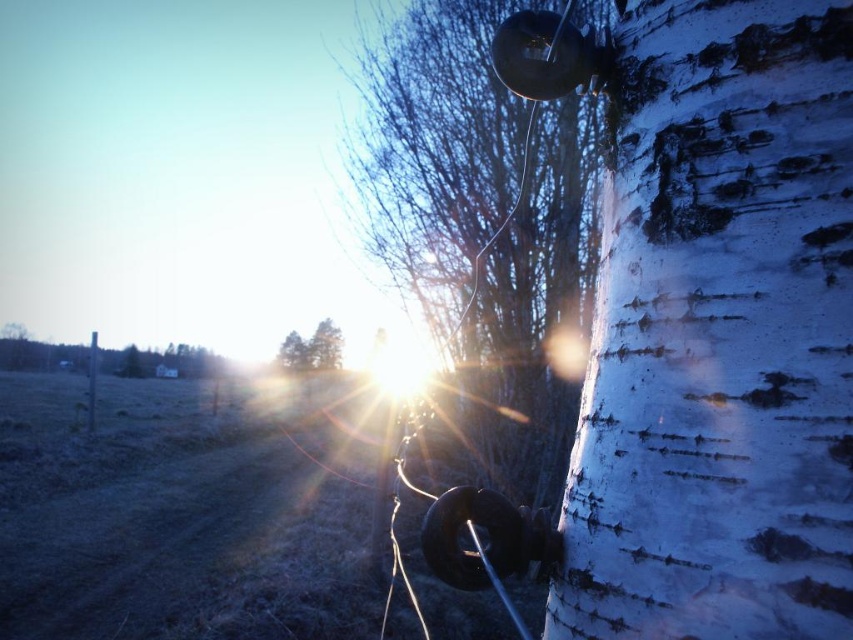
Between point (711, 502) and point (317, 348), which one is positioned in front?

Positioned in front is point (711, 502).

Who is lower down, white textured bark at right or brown wood trees at center?

brown wood trees at center

What do you see at coordinates (718, 333) in the screenshot?
I see `white textured bark at right` at bounding box center [718, 333].

Image resolution: width=853 pixels, height=640 pixels. I want to click on white textured bark at right, so click(718, 333).

Can you confirm if white textured bark at right is taller than smooth gray pole at center?

Incorrect, white textured bark at right's height is not larger of smooth gray pole at center's.

Who is higher up, white textured bark at right or smooth gray pole at center?

white textured bark at right is higher up.

Locate an element on the screen. This screenshot has height=640, width=853. white textured bark at right is located at coordinates (718, 333).

This screenshot has height=640, width=853. What are the coordinates of `white textured bark at right` in the screenshot? It's located at (718, 333).

Is white textured bark at upper right closer to camera compared to smooth gray pole at center?

Yes.

Is white textured bark at upper right below smooth gray pole at center?

No, white textured bark at upper right is not below smooth gray pole at center.

The image size is (853, 640). In order to click on white textured bark at upper right in this screenshot , I will do `click(480, 220)`.